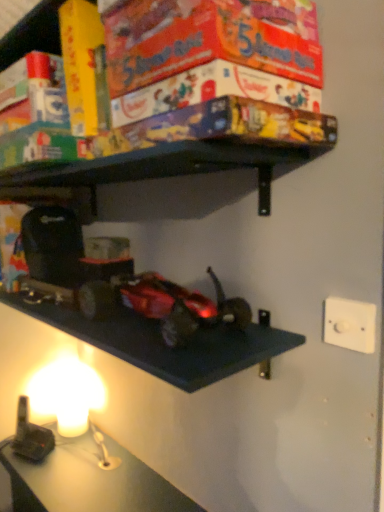
Question: Is shiny metallic car at center behind white plastic/light switch at upper right?

Choices:
 (A) yes
 (B) no

Answer: (B)

Question: Would you say white plastic/light switch at upper right is part of shiny metallic car at center's contents?

Choices:
 (A) no
 (B) yes

Answer: (A)

Question: From a real-world perspective, does shiny metallic car at center sit lower than white plastic/light switch at upper right?

Choices:
 (A) yes
 (B) no

Answer: (B)

Question: Is shiny metallic car at center positioned beyond the bounds of white plastic/light switch at upper right?

Choices:
 (A) no
 (B) yes

Answer: (B)

Question: Is shiny metallic car at center positioned in front of white plastic/light switch at upper right?

Choices:
 (A) no
 (B) yes

Answer: (B)

Question: Considering the relative sizes of shiny metallic car at center and white plastic/light switch at upper right in the image provided, is shiny metallic car at center shorter than white plastic/light switch at upper right?

Choices:
 (A) no
 (B) yes

Answer: (A)

Question: Is shiny metallic car at center at the back of white plastic/light switch at upper right?

Choices:
 (A) no
 (B) yes

Answer: (A)

Question: From a real-world perspective, is white plastic/light switch at upper right positioned over shiny metallic car at center based on gravity?

Choices:
 (A) yes
 (B) no

Answer: (B)

Question: From the image's perspective, is white plastic/light switch at upper right on top of shiny metallic car at center?

Choices:
 (A) no
 (B) yes

Answer: (A)

Question: Does white plastic/light switch at upper right appear on the left side of shiny metallic car at center?

Choices:
 (A) no
 (B) yes

Answer: (A)

Question: Can you confirm if white plastic/light switch at upper right is positioned to the right of shiny metallic car at center?

Choices:
 (A) no
 (B) yes

Answer: (B)

Question: From a real-world perspective, is white plastic/light switch at upper right physically below shiny metallic car at center?

Choices:
 (A) no
 (B) yes

Answer: (B)

Question: In the image, is shiny metallic car at center positioned in front of or behind white plastic/light switch at upper right?

Choices:
 (A) behind
 (B) front

Answer: (B)